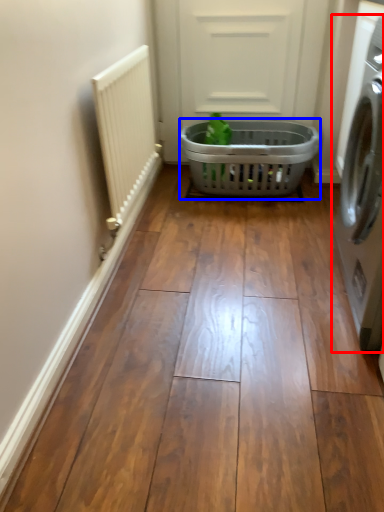
Question: Which point is further to the camera, washing machine (highlighted by a red box) or basket (highlighted by a blue box)?

Choices:
 (A) washing machine
 (B) basket

Answer: (B)